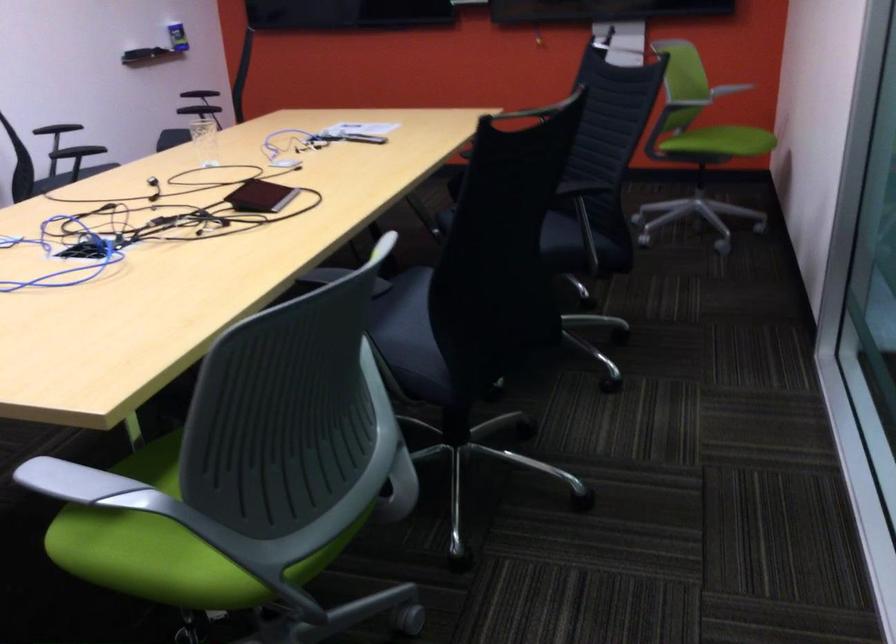
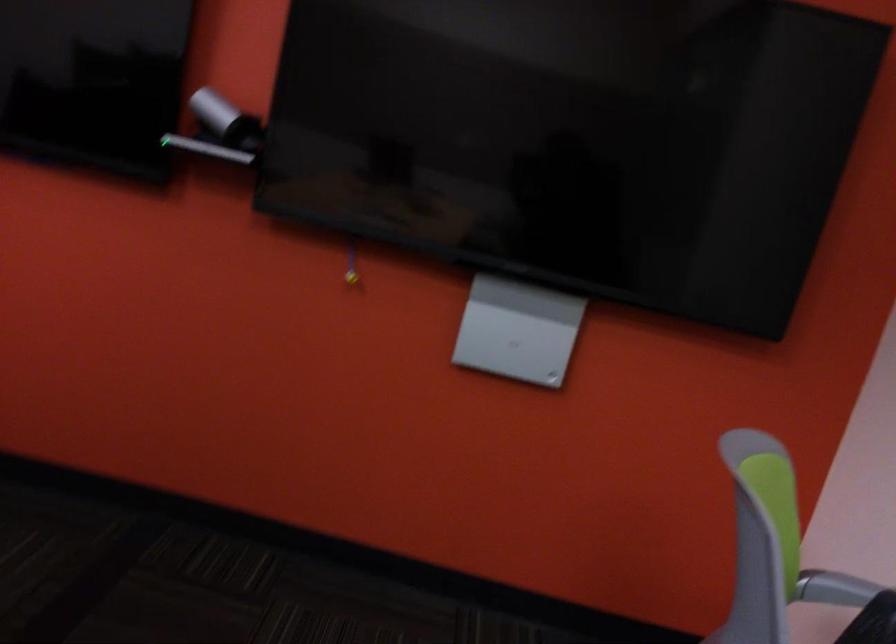
Question: In a continuous first-person perspective shot, in which direction is the camera moving?

Choices:
 (A) Left
 (B) Right
 (C) Forward
 (D) Backward

Answer: (C)